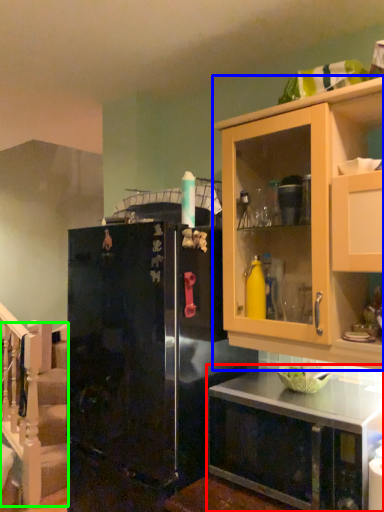
Question: Which object is positioned closest to countertop (highlighted by a red box)? Select from cabinetry (highlighted by a blue box) and stairwell (highlighted by a green box).

Choices:
 (A) cabinetry
 (B) stairwell

Answer: (A)